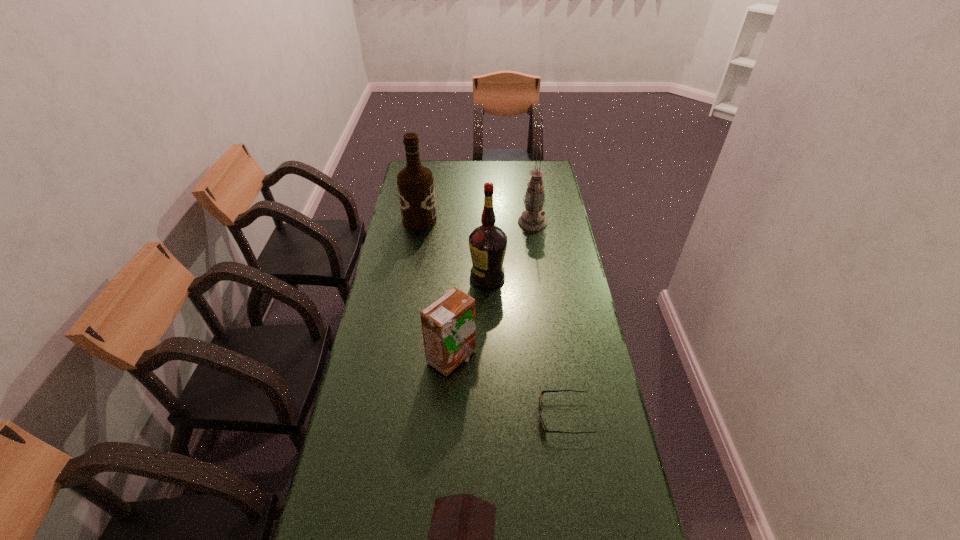
Locate an element on the screen. Image resolution: width=960 pixels, height=540 pixels. empty space that is in between the farther alcohol and the carton is located at coordinates (436, 289).

The width and height of the screenshot is (960, 540). I want to click on free space between the nearer alcohol and the farther alcohol, so click(x=453, y=248).

You are a GUI agent. You are given a task and a screenshot of the screen. Output one action in this format:
    pyautogui.click(x=<x>, y=<y>)
    Task: Click on the vacant area that lies between the fourth tallest object and the oil lamp
    This screenshot has height=540, width=960.
    Given the screenshot: What is the action you would take?
    (x=492, y=291)

Where is `object identified as the fifth closest to the oil lamp`? object identified as the fifth closest to the oil lamp is located at coordinates (461, 538).

I want to click on object that is the fifth closest to the nearest object, so [x=415, y=183].

This screenshot has width=960, height=540. Find the location of `free space in the image that satisfies the following two spatial constraints: 1. on the back side of the oil lamp; 2. on the label of the leftmost object`. free space in the image that satisfies the following two spatial constraints: 1. on the back side of the oil lamp; 2. on the label of the leftmost object is located at coordinates (532, 220).